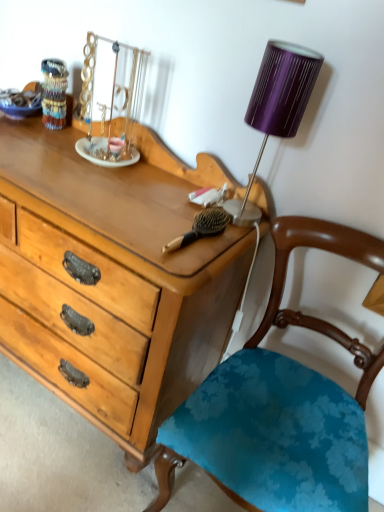
Question: Is multicolored glass beads at upper left beside brown wooden brush at center?

Choices:
 (A) yes
 (B) no

Answer: (B)

Question: Is multicolored glass beads at upper left oriented towards brown wooden brush at center?

Choices:
 (A) no
 (B) yes

Answer: (A)

Question: Is multicolored glass beads at upper left far away from brown wooden brush at center?

Choices:
 (A) no
 (B) yes

Answer: (A)

Question: Is multicolored glass beads at upper left at the right side of brown wooden brush at center?

Choices:
 (A) no
 (B) yes

Answer: (A)

Question: Does multicolored glass beads at upper left have a smaller size compared to brown wooden brush at center?

Choices:
 (A) yes
 (B) no

Answer: (B)

Question: From a real-world perspective, is multicolored glass beads at upper left on top of brown wooden brush at center?

Choices:
 (A) yes
 (B) no

Answer: (A)

Question: From a real-world perspective, does purple ribbed fabric lampshade at upper right sit lower than brown wooden brush at center?

Choices:
 (A) yes
 (B) no

Answer: (B)

Question: Does purple ribbed fabric lampshade at upper right have a greater width compared to brown wooden brush at center?

Choices:
 (A) no
 (B) yes

Answer: (A)

Question: Does purple ribbed fabric lampshade at upper right have a lesser width compared to brown wooden brush at center?

Choices:
 (A) yes
 (B) no

Answer: (A)

Question: Is purple ribbed fabric lampshade at upper right behind brown wooden brush at center?

Choices:
 (A) yes
 (B) no

Answer: (B)

Question: From the image's perspective, is purple ribbed fabric lampshade at upper right under brown wooden brush at center?

Choices:
 (A) no
 (B) yes

Answer: (A)

Question: Considering the relative positions of purple ribbed fabric lampshade at upper right and brown wooden brush at center in the image provided, is purple ribbed fabric lampshade at upper right in front of brown wooden brush at center?

Choices:
 (A) no
 (B) yes

Answer: (B)

Question: Is purple ribbed fabric lampshade at upper right looking in the opposite direction of blue floral fabric chair at center?

Choices:
 (A) no
 (B) yes

Answer: (A)